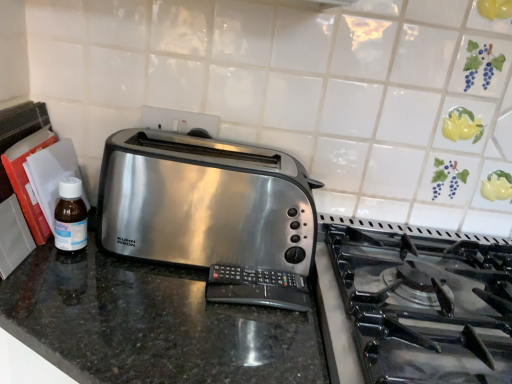
I want to click on vacant area that is in front of translucent plastic bottle at left, so click(x=57, y=297).